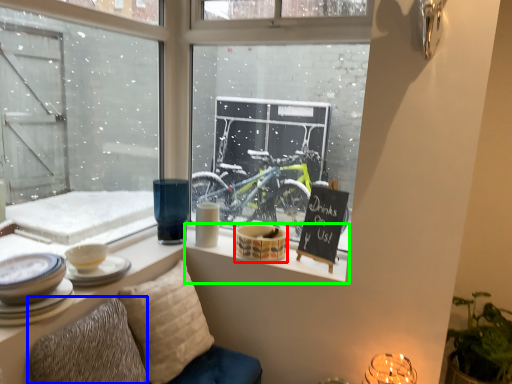
Question: Which object is positioned farthest from tableware (highlighted by a red box)? Select from pillow (highlighted by a blue box) and window sill (highlighted by a green box).

Choices:
 (A) pillow
 (B) window sill

Answer: (A)